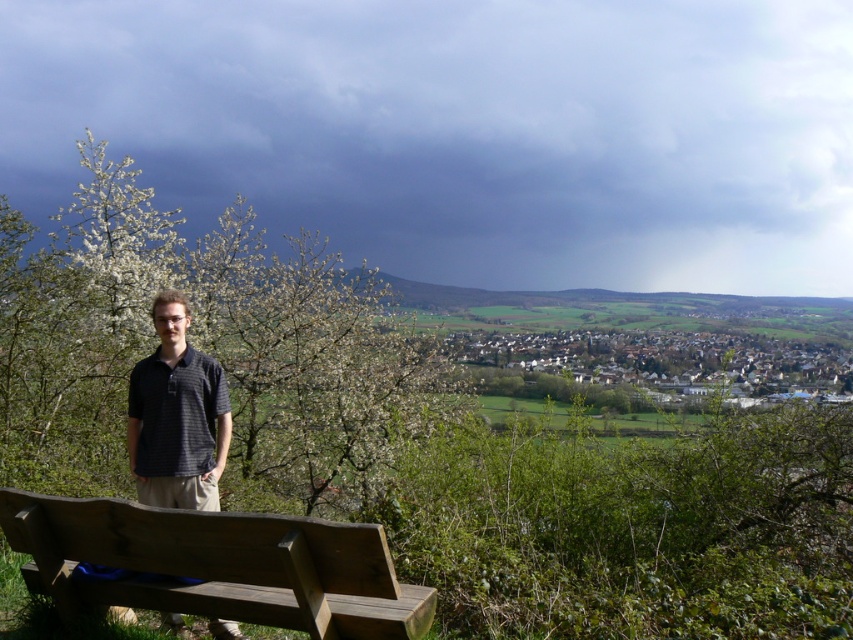
Does point (119, 502) come in front of point (190, 481)?

That is True.

Which is behind, point (271, 609) or point (137, 483)?

The point (137, 483) is more distant.

Is point (312, 576) positioned behind point (178, 300)?

That is False.

Locate an element on the screen. The image size is (853, 640). wooden bench at lower left is located at coordinates (218, 564).

Between point (445, 406) and point (403, 628), which one is positioned behind?

Positioned behind is point (445, 406).

Is green leafy tree at left to the right of wooden bench at lower left from the viewer's perspective?

No, green leafy tree at left is not to the right of wooden bench at lower left.

The width and height of the screenshot is (853, 640). I want to click on green leafy tree at left, so click(204, 349).

Does green leafy tree at left have a lesser height compared to dark blue striped polo shirt at center?

In fact, green leafy tree at left may be taller than dark blue striped polo shirt at center.

Is green leafy tree at left bigger than dark blue striped polo shirt at center?

Yes, green leafy tree at left is bigger than dark blue striped polo shirt at center.

Does point (274, 499) lie behind point (184, 339)?

Yes.

Locate an element on the screen. This screenshot has width=853, height=640. green leafy tree at left is located at coordinates (204, 349).